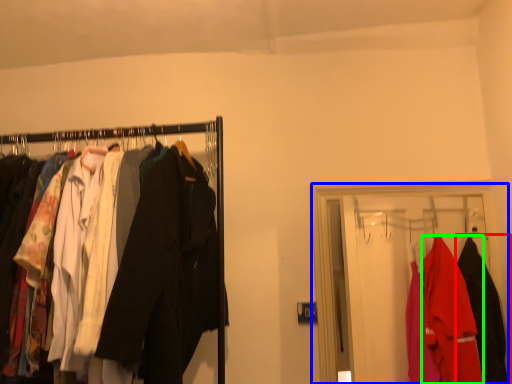
Question: Based on their relative distances, which object is nearer to fancy dress (highlighted by a red box)? Choose from closet (highlighted by a blue box) and fancy dress (highlighted by a green box).

Choices:
 (A) closet
 (B) fancy dress

Answer: (B)